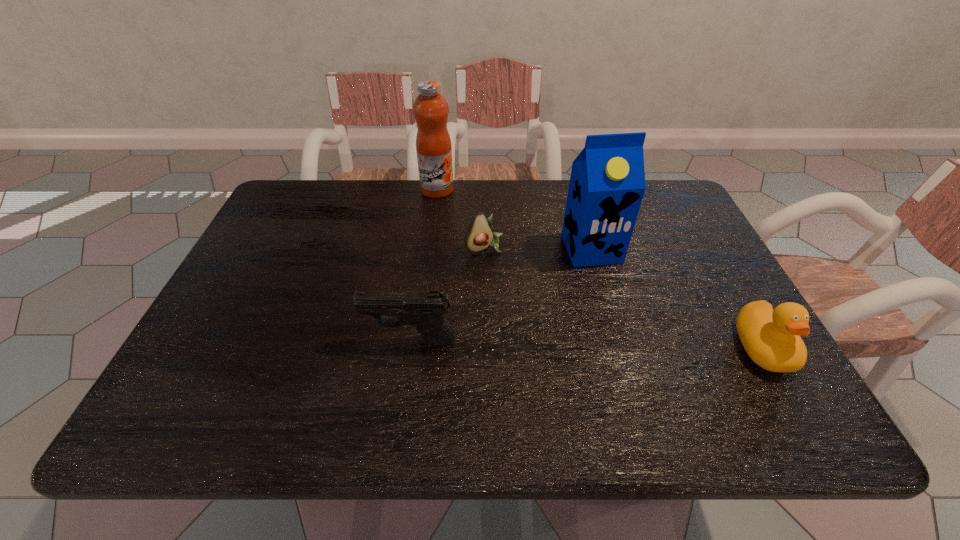
Identify the location of object positioned at the near right corner. This screenshot has height=540, width=960. (771, 338).

Where is `blank area at the far edge`? blank area at the far edge is located at coordinates (514, 207).

This screenshot has width=960, height=540. In the image, there is a desktop. Find the location of `free region at the left edge`. free region at the left edge is located at coordinates (275, 274).

In order to click on vacant space at the far left corner of the desktop in this screenshot , I will do `click(321, 217)`.

At what (x,y) coordinates should I click in order to perform the action: click on empty space between the carton and the pistol. Please return your answer as a coordinate pair (x, y). This screenshot has width=960, height=540. Looking at the image, I should click on (501, 294).

The height and width of the screenshot is (540, 960). What are the coordinates of `free point between the carton and the pistol` in the screenshot? It's located at (501, 294).

Where is `unoccupied area between the pistol and the farthest object`? The width and height of the screenshot is (960, 540). unoccupied area between the pistol and the farthest object is located at coordinates tap(424, 265).

Identify the location of vacant region between the farthest object and the pistol. (424, 265).

Locate an element on the screen. free space that is in between the fruit juice and the rightmost object is located at coordinates (600, 269).

Locate an element on the screen. The height and width of the screenshot is (540, 960). vacant space that is in between the carton and the duck is located at coordinates (677, 299).